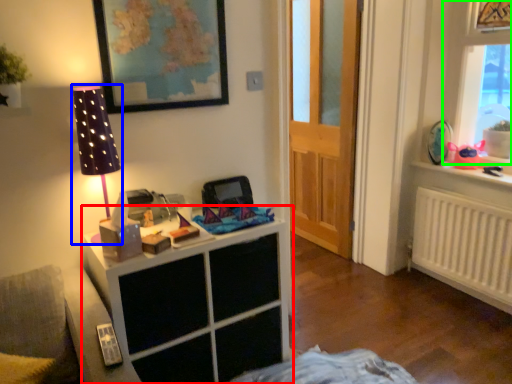
Question: Based on their relative distances, which object is nearer to cabinetry (highlighted by a red box)? Choose from table lamp (highlighted by a blue box) and window (highlighted by a green box).

Choices:
 (A) table lamp
 (B) window

Answer: (A)